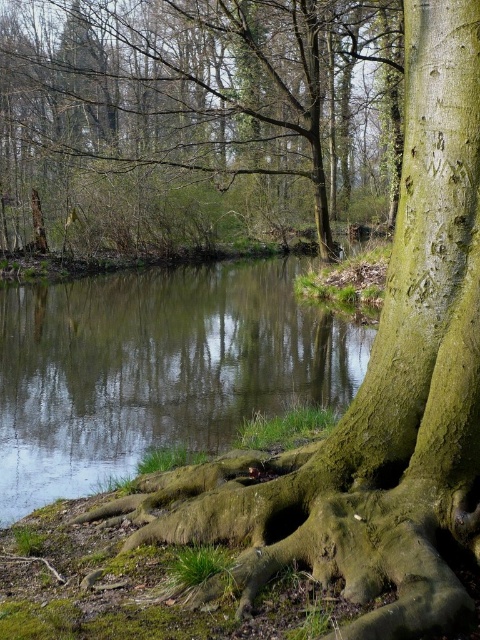
Image resolution: width=480 pixels, height=640 pixels. What do you see at coordinates (196, 118) in the screenshot?
I see `green mossy tree roots at lower left` at bounding box center [196, 118].

Between green mossy tree roots at lower left and green mossy stream at center, which one has less height?

Standing shorter between the two is green mossy stream at center.

Which is behind, point (118, 52) or point (204, 285)?

Positioned behind is point (118, 52).

Find the location of `green mossy tree roots at lower left`. green mossy tree roots at lower left is located at coordinates (196, 118).